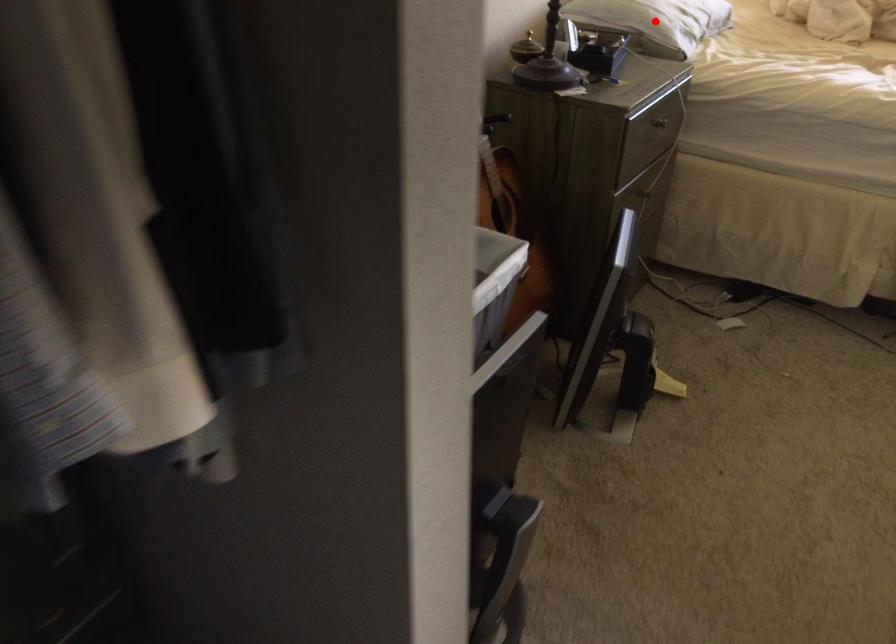
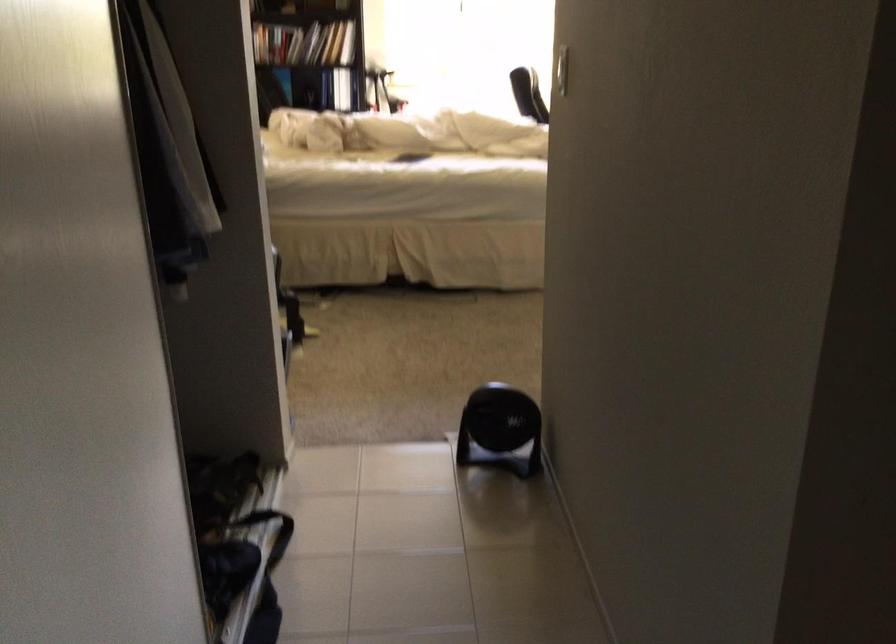
Question: I am providing you with two images of the same scene from different viewpoints. A red point is marked on the first image. At the location where the point appears in image 1, is it still visible in image 2?

Choices:
 (A) Yes
 (B) No

Answer: (B)